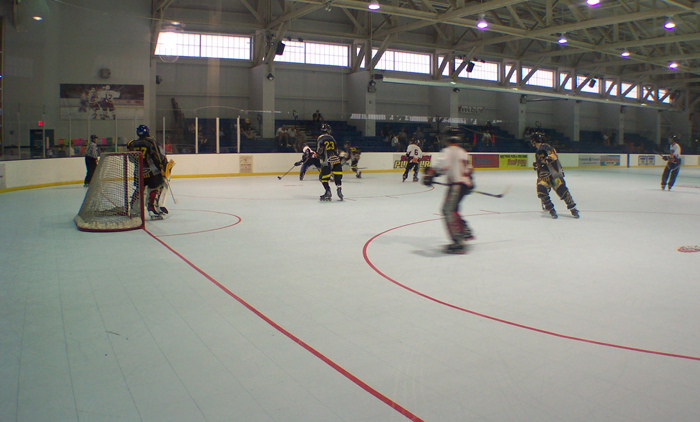
The image size is (700, 422). What are the coordinates of `windows` in the screenshot? It's located at (222, 48), (302, 51), (409, 70), (470, 64), (536, 81), (588, 86), (631, 90).